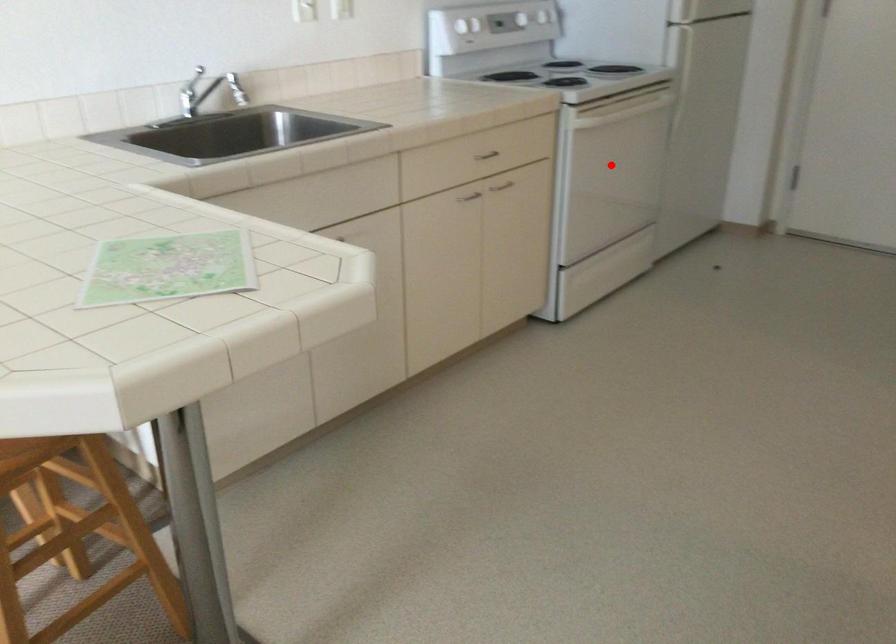
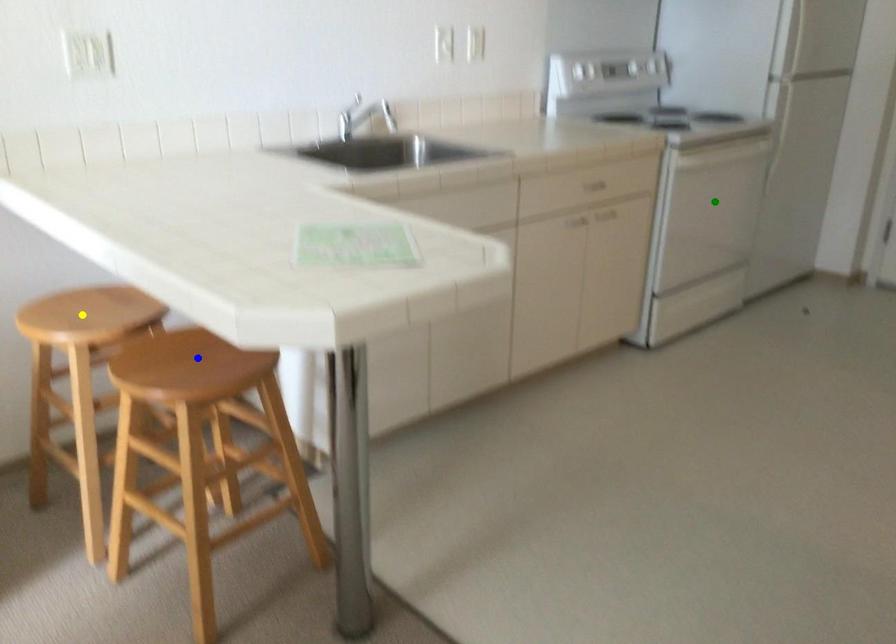
Question: I am providing you with two images of the same scene from different viewpoints. A red point is marked on the first image. You are given multiple points on the second image. Can you choose the point in image 2 that corresponds to the point in image 1?

Choices:
 (A) yellow point
 (B) green point
 (C) blue point

Answer: (B)